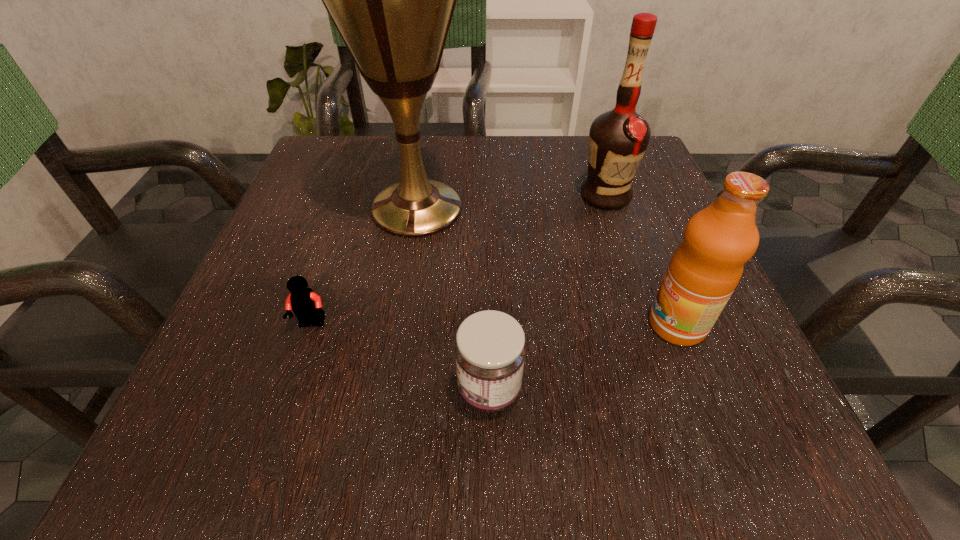
Identify the location of blank area at the near right corner. The height and width of the screenshot is (540, 960). (753, 433).

Find the location of a particular element. free space between the second tallest object and the shortest object is located at coordinates (459, 260).

The width and height of the screenshot is (960, 540). Identify the location of empty space between the trophy cup and the jam. (453, 299).

Where is `empty space between the tallest object and the Lego`? This screenshot has width=960, height=540. empty space between the tallest object and the Lego is located at coordinates (365, 266).

Image resolution: width=960 pixels, height=540 pixels. Find the location of `free space between the liquor and the fruit juice`. free space between the liquor and the fruit juice is located at coordinates (640, 260).

Locate an element on the screen. This screenshot has width=960, height=540. vacant area that lies between the tallest object and the shortest object is located at coordinates (365, 266).

What are the coordinates of `free space between the tallest object and the fourth shortest object` in the screenshot? It's located at (511, 202).

The width and height of the screenshot is (960, 540). Identify the location of unoccupied area between the tallest object and the second tallest object. (511, 202).

Select which object is the closest to the liquor. Please provide its 2D coordinates. Your answer should be formatted as a tuple, i.e. [(x, y)], where the tuple contains the x and y coordinates of a point satisfying the conditions above.

[(392, 0)]

The width and height of the screenshot is (960, 540). What are the coordinates of `the second closest object to the fourth shortest object` in the screenshot? It's located at (705, 269).